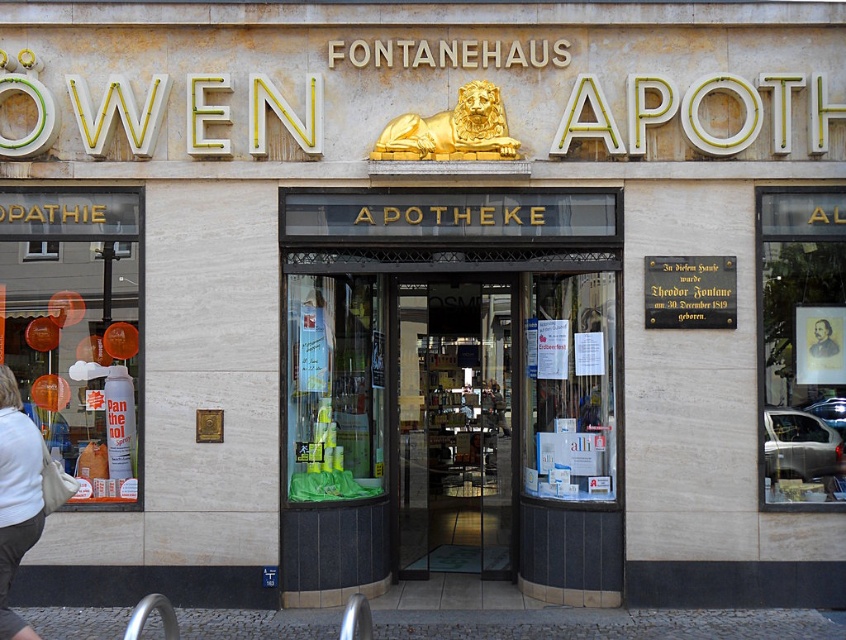
You are a customer entering the pharmacy and see the translucent plastic bottles at left and the white cotton shirt at lower left. Which item is located more to the left side of the pharmacy?

The translucent plastic bottles at left are more to the left side of the pharmacy than the white cotton shirt at lower left.

You are standing in front of the pharmacy entrance. Where exactly is the matte glass door at center located in terms of its 2D coordinates?

The matte glass door at center is located at the 2D coordinates of point (x=451, y=388).

You are a customer standing outside the pharmacy entrance. You notice the translucent plastic bottles at left and the white cotton shirt at lower left inside the store. From your perspective outside, which object appears taller?

The translucent plastic bottles at left appears taller than the white cotton shirt at lower left.